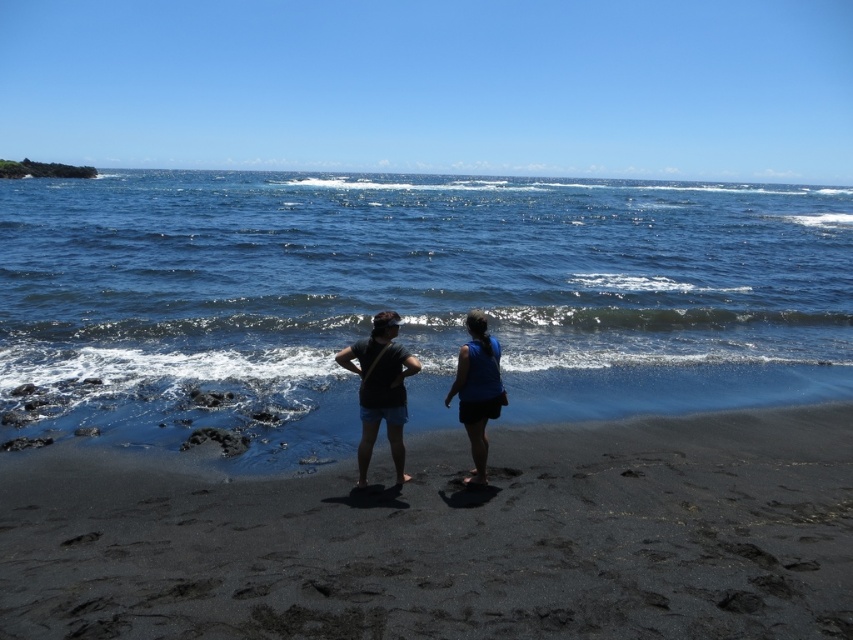
Question: Among these points, which one is nearest to the camera?

Choices:
 (A) (409, 316)
 (B) (387, 369)
 (C) (782, 429)

Answer: (B)

Question: Can you confirm if black sand at center is wider than blue fabric skirt at center?

Choices:
 (A) no
 (B) yes

Answer: (B)

Question: Among these points, which one is farthest from the camera?

Choices:
 (A) (428, 220)
 (B) (389, 404)
 (C) (459, 369)
 (D) (131, 573)

Answer: (A)

Question: Which is farther from the black sand at center?

Choices:
 (A) dark gray fabric shirt at center
 (B) blue fabric skirt at center
 (C) blue water at center

Answer: (C)

Question: Is the position of matte black shorts at center less distant than that of dark gray fabric shirt at center?

Choices:
 (A) no
 (B) yes

Answer: (A)

Question: Can you confirm if dark gray fabric shirt at center is thinner than blue fabric skirt at center?

Choices:
 (A) no
 (B) yes

Answer: (A)